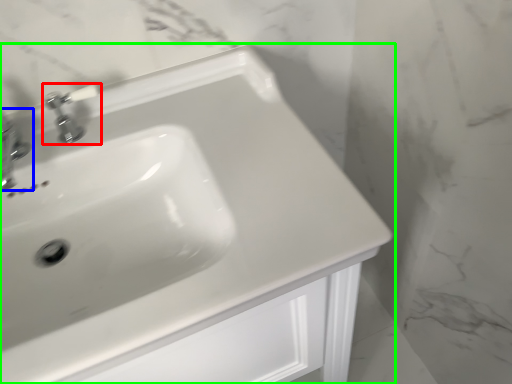
Question: Which is farther away from tap (highlighted by a red box)? tap (highlighted by a blue box) or sink (highlighted by a green box)?

Choices:
 (A) tap
 (B) sink

Answer: (B)